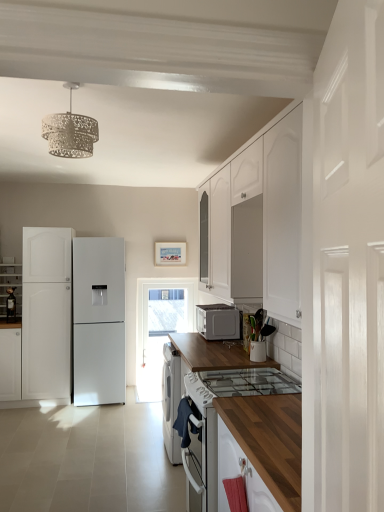
How much space does white matte cabinet at left, arranged as the 2th cabinetry when viewed from the left, occupy horizontally?

The width of white matte cabinet at left, arranged as the 2th cabinetry when viewed from the left, is 23.44 inches.

The height and width of the screenshot is (512, 384). What are the coordinates of `white matte cabinet at left, arranged as the 2th cabinetry when viewed from the left` in the screenshot? It's located at (10, 364).

What is the approximate height of transparent glass door at center?

transparent glass door at center is 5.20 feet in height.

The height and width of the screenshot is (512, 384). What do you see at coordinates (46, 313) in the screenshot?
I see `white matte refrigerator at left, positioned as the 3th cabinetry in left-to-right order` at bounding box center [46, 313].

What is the approximate height of white textured chandelier at upper center?

37.23 centimeters.

Locate an element on the screen. The image size is (384, 512). white glossy door at right is located at coordinates (347, 268).

Image resolution: width=384 pixels, height=512 pixels. What do you see at coordinates (218, 322) in the screenshot?
I see `white matte microwave at center` at bounding box center [218, 322].

Find the location of `white glossy refrigerator at left, arranged as the first cabinetry when viewed from the left`. white glossy refrigerator at left, arranged as the first cabinetry when viewed from the left is located at coordinates (10, 287).

At what (x,y) coordinates should I click in order to perform the action: click on white matte cabinet at left, arranged as the 2th cabinetry when viewed from the left. Please return your answer as a coordinate pair (x, y). Looking at the image, I should click on (10, 364).

Considering the relative sizes of white matte cabinet at left, arranged as the 2th cabinetry when viewed from the left, and white glossy door at right in the image provided, is white matte cabinet at left, arranged as the 2th cabinetry when viewed from the left, thinner than white glossy door at right?

In fact, white matte cabinet at left, arranged as the 2th cabinetry when viewed from the left, might be wider than white glossy door at right.

From a real-world perspective, which object rests below the other?

white matte cabinet at left, the 2th cabinetry from the right, from a real-world perspective.

Considering the sizes of objects white matte cabinet at left, arranged as the 2th cabinetry when viewed from the left, and white glossy door at right in the image provided, who is shorter, white matte cabinet at left, arranged as the 2th cabinetry when viewed from the left, or white glossy door at right?

white matte cabinet at left, arranged as the 2th cabinetry when viewed from the left.

From the image's perspective, does white matte cabinet at left, arranged as the 2th cabinetry when viewed from the left, appear lower than white glossy door at right?

Correct, white matte cabinet at left, arranged as the 2th cabinetry when viewed from the left, appears lower than white glossy door at right in the image.

From a real-world perspective, is white glossy refrigerator at left, the 3th cabinetry from the right, physically located above or below white matte microwave at center?

In terms of real-world spatial position, white glossy refrigerator at left, the 3th cabinetry from the right, is above white matte microwave at center.

Which object is further away from the camera, white glossy refrigerator at left, the 3th cabinetry from the right, or white matte microwave at center?

white glossy refrigerator at left, the 3th cabinetry from the right, is further away from the camera.

I want to click on cabinetry above the white matte microwave at center (from the image's perspective), so click(10, 287).

Is the surface of white glossy refrigerator at left, the 3th cabinetry from the right, in direct contact with white matte microwave at center?

No, white glossy refrigerator at left, the 3th cabinetry from the right, is not touching white matte microwave at center.

Is white matte cabinet at left, the 2th cabinetry from the right, at the back of white glossy door at right?

white glossy door at right is not turned away from white matte cabinet at left, the 2th cabinetry from the right.

Between white glossy door at right and white matte cabinet at left, arranged as the 2th cabinetry when viewed from the left, which one appears on the left side from the viewer's perspective?

white matte cabinet at left, arranged as the 2th cabinetry when viewed from the left, is more to the left.

From the image's perspective, which object appears higher, white glossy door at right or white matte cabinet at left, the 2th cabinetry from the right?

From the image's view, white glossy door at right is above.

Does white textured chandelier at upper center have a smaller size compared to white matte microwave at center?

Indeed, white textured chandelier at upper center has a smaller size compared to white matte microwave at center.

From the image's perspective, is white textured chandelier at upper center located beneath white matte microwave at center?

Actually, white textured chandelier at upper center appears above white matte microwave at center in the image.

What's the angular difference between white textured chandelier at upper center and white matte microwave at center's facing directions?

85.1 degrees.

Considering the relative sizes of white textured chandelier at upper center and white matte microwave at center in the image provided, is white textured chandelier at upper center thinner than white matte microwave at center?

Yes, white textured chandelier at upper center is thinner than white matte microwave at center.

Is transparent glass door at center aimed at white matte refrigerator at left, the first cabinetry viewed from the right?

No.

There is a transparent glass door at center. Where is `the 1st cabinetry above it (from a real-world perspective)`? This screenshot has height=512, width=384. the 1st cabinetry above it (from a real-world perspective) is located at coordinates (46, 313).

Considering the sizes of transparent glass door at center and white matte refrigerator at left, positioned as the 3th cabinetry in left-to-right order, in the image, is transparent glass door at center taller or shorter than white matte refrigerator at left, positioned as the 3th cabinetry in left-to-right order,?

Clearly, transparent glass door at center is shorter compared to white matte refrigerator at left, positioned as the 3th cabinetry in left-to-right order.

Can you tell me how much transparent glass door at center and white matte refrigerator at left, positioned as the 3th cabinetry in left-to-right order, differ in facing direction?

0.000126 degrees.

Based on the photo, is white glossy door at right further to the viewer compared to white glossy refrigerator at left, arranged as the first cabinetry when viewed from the left?

That is False.

Considering the sizes of objects white glossy door at right and white glossy refrigerator at left, the 3th cabinetry from the right, in the image provided, who is taller, white glossy door at right or white glossy refrigerator at left, the 3th cabinetry from the right,?

white glossy door at right is taller.

Considering the relative sizes of white glossy door at right and white glossy refrigerator at left, arranged as the first cabinetry when viewed from the left, in the image provided, is white glossy door at right wider than white glossy refrigerator at left, arranged as the first cabinetry when viewed from the left,?

No.

Considering the sizes of objects white glossy door at right and white glossy refrigerator at left, the 3th cabinetry from the right, in the image provided, who is bigger, white glossy door at right or white glossy refrigerator at left, the 3th cabinetry from the right,?

With larger size is white glossy door at right.

From the image's perspective, is white matte microwave at center located above white matte cabinet at left, arranged as the 2th cabinetry when viewed from the left?

Correct, white matte microwave at center appears higher than white matte cabinet at left, arranged as the 2th cabinetry when viewed from the left, in the image.

Looking at their sizes, would you say white matte microwave at center is wider or thinner than white matte cabinet at left, arranged as the 2th cabinetry when viewed from the left?

In the image, white matte microwave at center appears to be more narrow than white matte cabinet at left, arranged as the 2th cabinetry when viewed from the left.

Is white matte cabinet at left, the 2th cabinetry from the right, at the back of white matte microwave at center?

No, white matte microwave at center is not facing the opposite direction of white matte cabinet at left, the 2th cabinetry from the right.

Does point (211, 309) lie behind point (12, 353)?

No, (211, 309) is in front of (12, 353).

Locate an element on the screen. The width and height of the screenshot is (384, 512). the 1st cabinetry behind the white glossy door at right, starting your count from the anchor is located at coordinates [10, 364].

You are a GUI agent. You are given a task and a screenshot of the screen. Output one action in this format:
    pyautogui.click(x=<x>, y=<y>)
    Task: Click on the cabinetry positioned vertically above the white matte microwave at center (from a real-world perspective)
    This screenshot has width=384, height=512.
    Given the screenshot: What is the action you would take?
    pyautogui.click(x=10, y=287)

Estimate the real-world distances between objects in this image. Which object is further from white matte microwave at center, white glossy refrigerator at left, the 3th cabinetry from the right, or transparent glass door at center?

Among the two, white glossy refrigerator at left, the 3th cabinetry from the right, is located further to white matte microwave at center.

Looking at the image, which one is located closer to white matte refrigerator at left, the first cabinetry viewed from the right, white matte microwave at center or white textured chandelier at upper center?

The object closer to white matte refrigerator at left, the first cabinetry viewed from the right, is white matte microwave at center.

From the image, which object appears to be nearer to white textured chandelier at upper center, white matte cabinet at left, arranged as the 2th cabinetry when viewed from the left, or white glossy door at right?

white glossy door at right is closer to white textured chandelier at upper center.

Which object lies further to the anchor point white matte cabinet at left, the 2th cabinetry from the right, white matte refrigerator at left, the first cabinetry viewed from the right, or transparent glass door at center?

Among the two, transparent glass door at center is located further to white matte cabinet at left, the 2th cabinetry from the right.

Looking at this image, based on their spatial positions, is white matte refrigerator at left, the first cabinetry viewed from the right, or white matte cabinet at left, arranged as the 2th cabinetry when viewed from the left, further from white textured chandelier at upper center?

Among the two, white matte cabinet at left, arranged as the 2th cabinetry when viewed from the left, is located further to white textured chandelier at upper center.

When comparing their distances from white textured chandelier at upper center, does white glossy door at right or white glossy refrigerator at left, the 3th cabinetry from the right, seem further?

Among the two, white glossy refrigerator at left, the 3th cabinetry from the right, is located further to white textured chandelier at upper center.

Looking at the image, which one is located further to white matte microwave at center, white glossy refrigerator at left, the 3th cabinetry from the right, or white glossy door at right?

The object further to white matte microwave at center is white glossy door at right.

Considering their positions, is white matte microwave at center positioned further to white textured chandelier at upper center than white matte refrigerator at left, the first cabinetry viewed from the right?

Based on the image, white matte refrigerator at left, the first cabinetry viewed from the right, appears to be further to white textured chandelier at upper center.

I want to click on home appliance positioned between white textured chandelier at upper center and white matte refrigerator at left, positioned as the 3th cabinetry in left-to-right order, from near to far, so click(218, 322).

The image size is (384, 512). Find the location of `home appliance located between white textured chandelier at upper center and white glossy refrigerator at left, the 3th cabinetry from the right, in the depth direction`. home appliance located between white textured chandelier at upper center and white glossy refrigerator at left, the 3th cabinetry from the right, in the depth direction is located at coordinates (x=218, y=322).

Where is `cabinetry located between white matte cabinet at left, the 2th cabinetry from the right, and transparent glass door at center in the left-right direction`? This screenshot has height=512, width=384. cabinetry located between white matte cabinet at left, the 2th cabinetry from the right, and transparent glass door at center in the left-right direction is located at coordinates (46, 313).

Where is `light fixture between white glossy door at right and white matte refrigerator at left, the first cabinetry viewed from the right, in the front-back direction`? light fixture between white glossy door at right and white matte refrigerator at left, the first cabinetry viewed from the right, in the front-back direction is located at coordinates click(x=70, y=132).